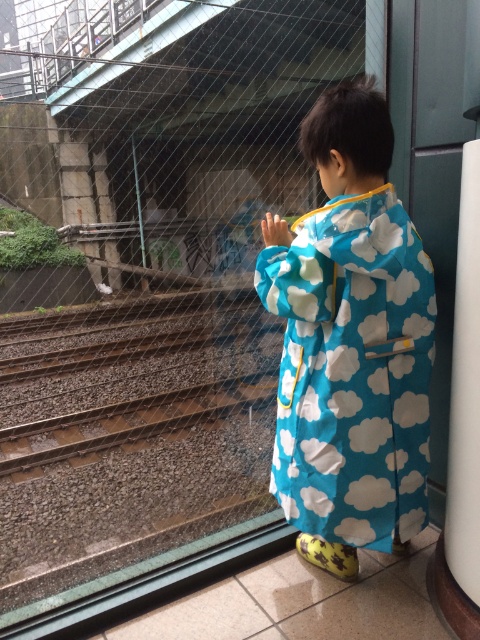
Question: Among these objects, which one is farthest from the camera?

Choices:
 (A) blue fabric raincoat at center
 (B) white smooth pillar at right

Answer: (A)

Question: Can you confirm if blue fabric raincoat at center is positioned below white smooth pillar at right?

Choices:
 (A) no
 (B) yes

Answer: (A)

Question: Can you confirm if blue fabric raincoat at center is positioned to the right of white smooth pillar at right?

Choices:
 (A) yes
 (B) no

Answer: (B)

Question: Which of the following is the closest to the observer?

Choices:
 (A) (475, 321)
 (B) (330, 90)

Answer: (A)

Question: Does blue fabric raincoat at center have a greater width compared to white smooth pillar at right?

Choices:
 (A) yes
 (B) no

Answer: (A)